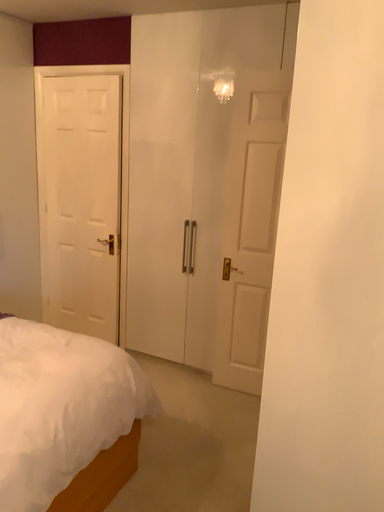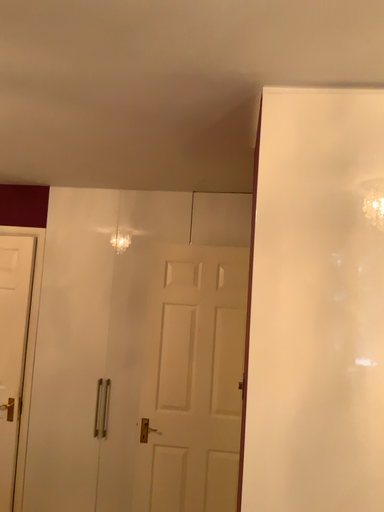
Question: Which way did the camera rotate in the video?

Choices:
 (A) rotated upward
 (B) rotated downward

Answer: (A)